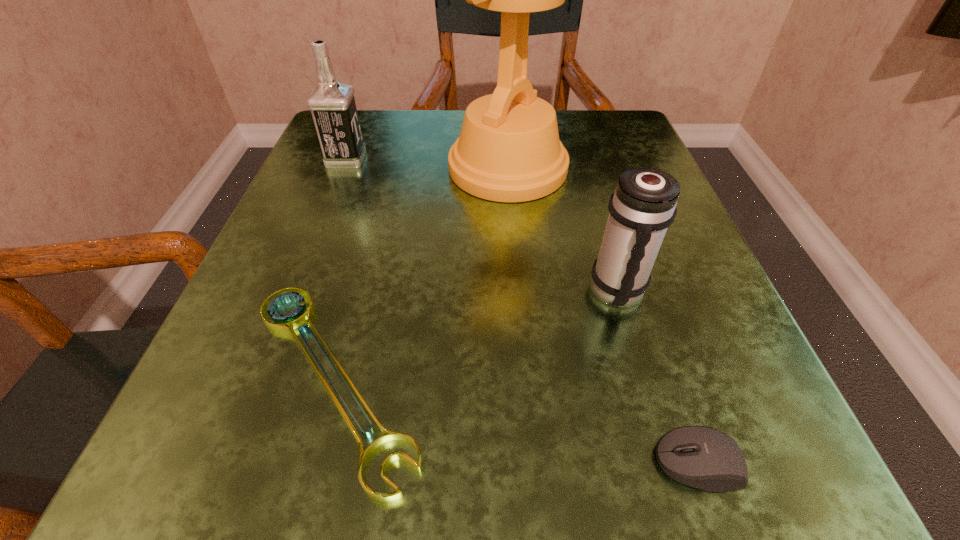
Where is `empty space that is in between the shortest object and the computer equipment`? The width and height of the screenshot is (960, 540). empty space that is in between the shortest object and the computer equipment is located at coordinates (516, 421).

Locate an element on the screen. This screenshot has height=540, width=960. vacant space that is in between the award and the third tallest object is located at coordinates (563, 230).

Find the location of a particular element. The height and width of the screenshot is (540, 960). empty location between the second tallest object and the thermos bottle is located at coordinates (482, 225).

Find the location of `blank region between the second tallest object and the thermos bottle`. blank region between the second tallest object and the thermos bottle is located at coordinates (482, 225).

This screenshot has height=540, width=960. I want to click on vacant region between the second shortest object and the tallest object, so click(604, 315).

I want to click on free space that is in between the vodka and the thermos bottle, so click(x=482, y=225).

Locate an element on the screen. free space that is in between the second tallest object and the wrench is located at coordinates (339, 269).

Image resolution: width=960 pixels, height=540 pixels. In order to click on free space between the tallest object and the second shortest object in this screenshot , I will do coord(604,315).

Where is `object that is the second closest one to the third tallest object`? This screenshot has height=540, width=960. object that is the second closest one to the third tallest object is located at coordinates [702, 457].

Identify which object is located as the nearest to the thermos bottle. Please provide its 2D coordinates. Your answer should be formatted as a tuple, i.e. [(x, y)], where the tuple contains the x and y coordinates of a point satisfying the conditions above.

[(508, 150)]